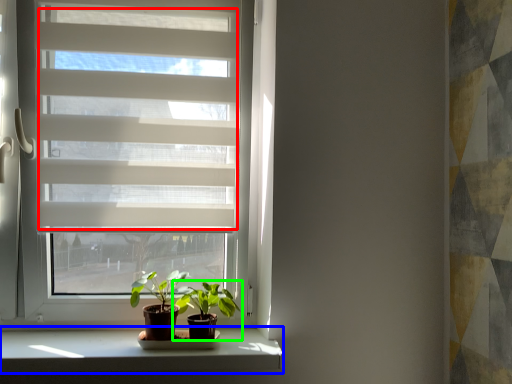
Question: Which object is positioned closest to blind (highlighted by a red box)? Select from window sill (highlighted by a blue box) and houseplant (highlighted by a green box).

Choices:
 (A) window sill
 (B) houseplant

Answer: (B)